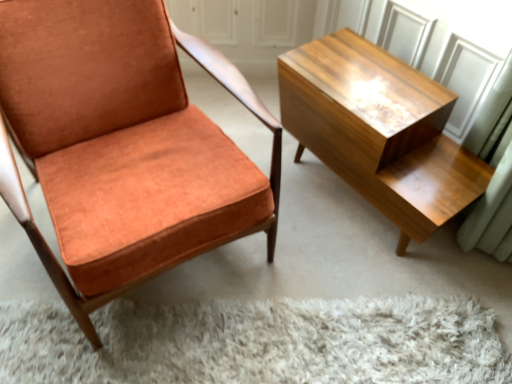
Question: Is matte orange fabric chair at left far away from shiny wood table at right?

Choices:
 (A) yes
 (B) no

Answer: (B)

Question: Is matte orange fabric chair at left in front of shiny wood table at right?

Choices:
 (A) no
 (B) yes

Answer: (B)

Question: Does matte orange fabric chair at left have a lesser width compared to shiny wood table at right?

Choices:
 (A) no
 (B) yes

Answer: (A)

Question: Does matte orange fabric chair at left have a greater width compared to shiny wood table at right?

Choices:
 (A) no
 (B) yes

Answer: (B)

Question: Does matte orange fabric chair at left have a lesser height compared to shiny wood table at right?

Choices:
 (A) yes
 (B) no

Answer: (B)

Question: Considering the relative positions of matte orange fabric chair at left and shiny wood table at right in the image provided, is matte orange fabric chair at left to the right of shiny wood table at right from the viewer's perspective?

Choices:
 (A) yes
 (B) no

Answer: (B)

Question: Is shiny wood table at right with matte orange fabric chair at left?

Choices:
 (A) no
 (B) yes

Answer: (A)

Question: Is shiny wood table at right not near matte orange fabric chair at left?

Choices:
 (A) yes
 (B) no

Answer: (B)

Question: Can you confirm if shiny wood table at right is shorter than matte orange fabric chair at left?

Choices:
 (A) yes
 (B) no

Answer: (A)

Question: From a real-world perspective, does shiny wood table at right sit lower than matte orange fabric chair at left?

Choices:
 (A) yes
 (B) no

Answer: (A)

Question: From the image's perspective, is shiny wood table at right below matte orange fabric chair at left?

Choices:
 (A) yes
 (B) no

Answer: (A)

Question: Is shiny wood table at right facing away from matte orange fabric chair at left?

Choices:
 (A) no
 (B) yes

Answer: (A)

Question: From a real-world perspective, relative to shiny wood table at right, is matte orange fabric chair at left vertically above or below?

Choices:
 (A) below
 (B) above

Answer: (B)